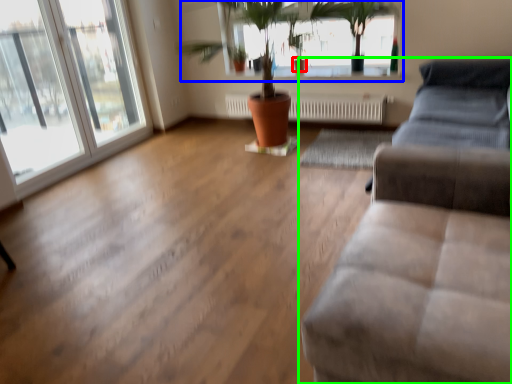
Question: Based on their relative distances, which object is farther from flowerpot (highlighted by a red box)? Choose from bay window (highlighted by a blue box) and studio couch (highlighted by a green box).

Choices:
 (A) bay window
 (B) studio couch

Answer: (B)